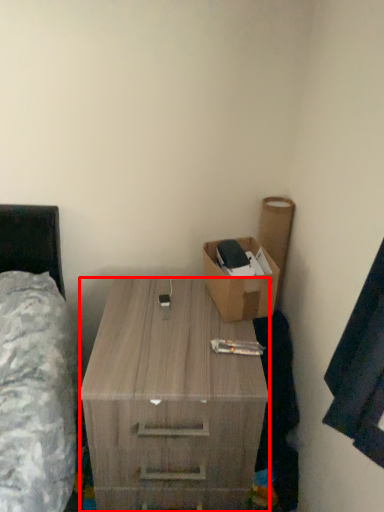
Question: From the image, what is the correct spatial relationship of desk (annotated by the red box) in relation to box?

Choices:
 (A) right
 (B) left

Answer: (B)